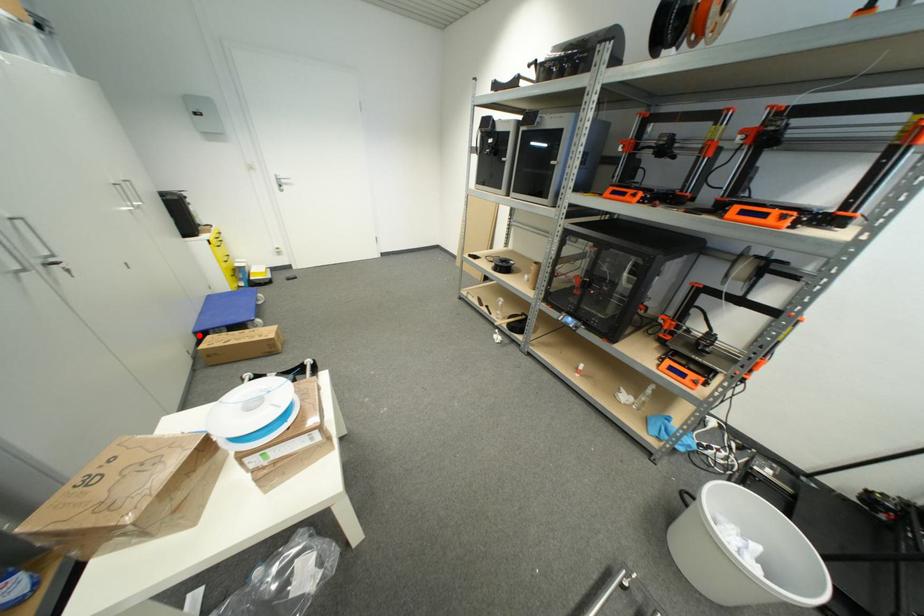
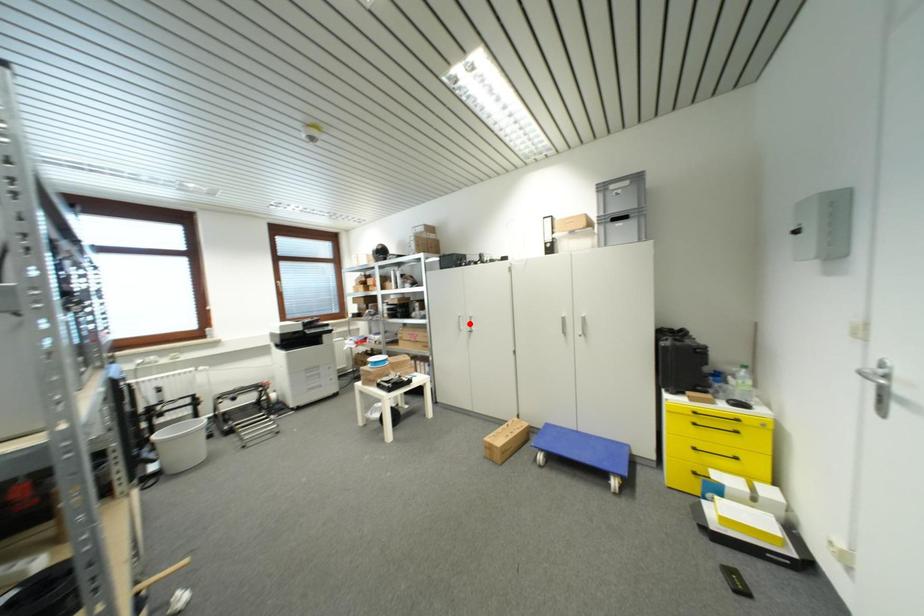
I am providing you with two images of the same scene from different viewpoints. A red point is marked on the first image and another point is marked on the second image. Do the highlighted points in image1 and image2 indicate the same real-world spot?

No